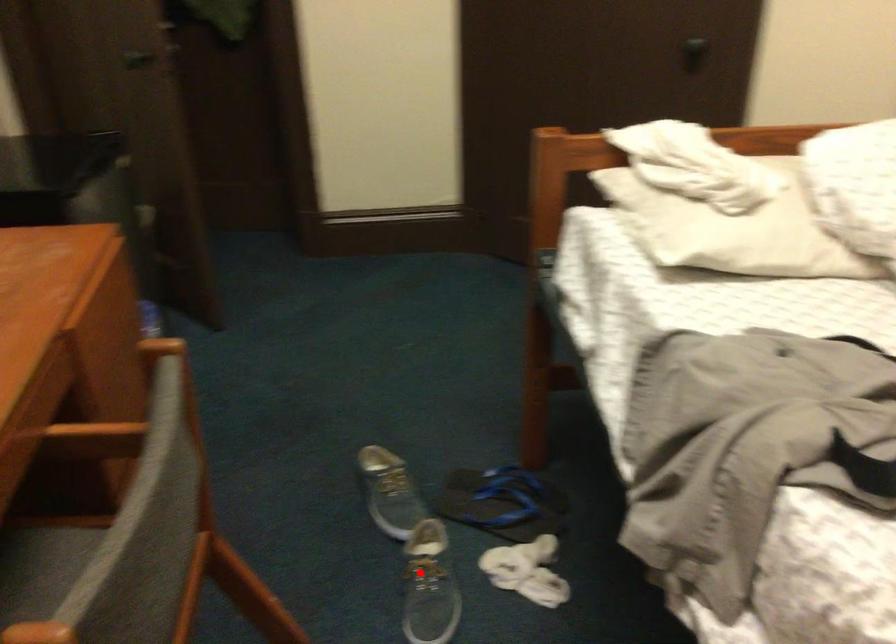
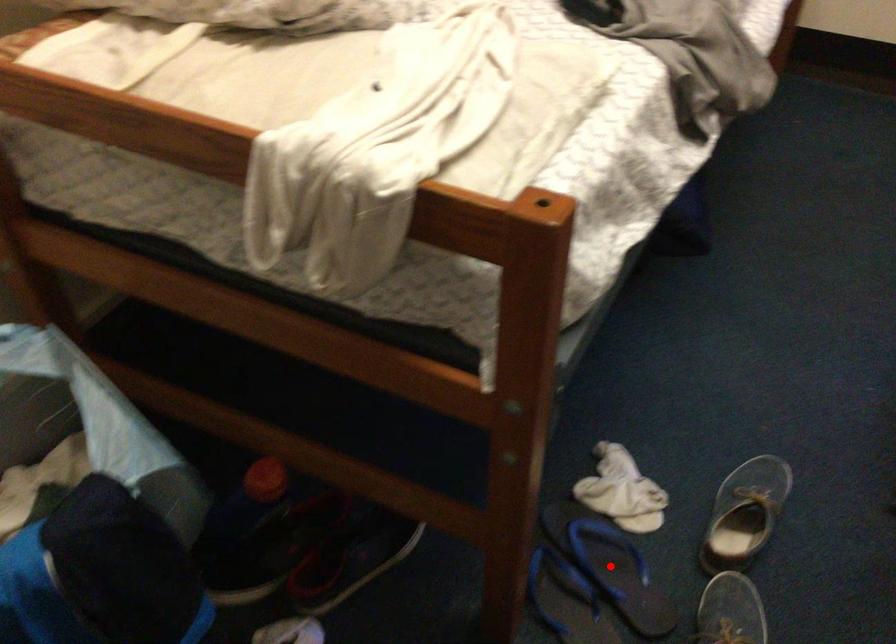
I am providing you with two images of the same scene from different viewpoints. A red point is marked on the first image and another point is marked on the second image. Are the points marked in image1 and image2 representing the same 3D position?

No